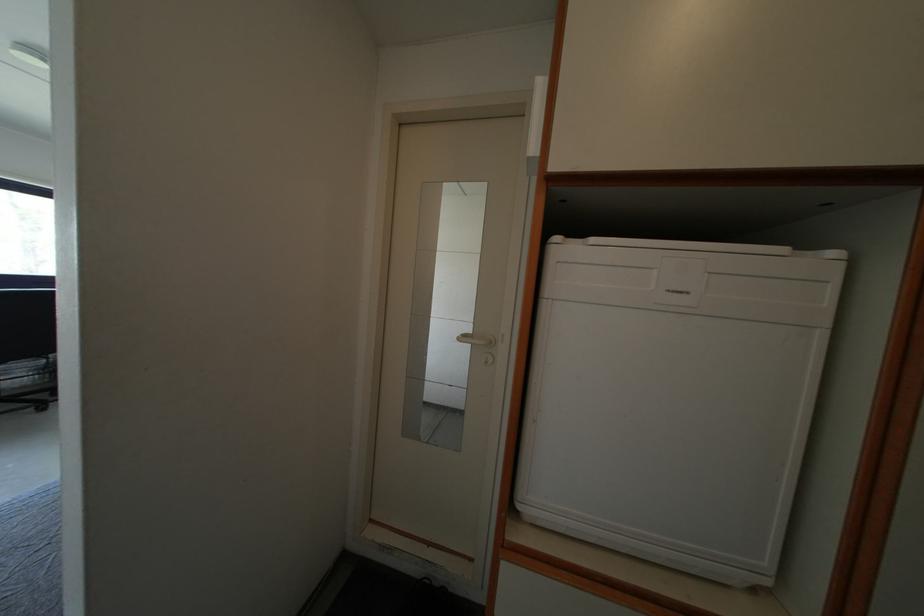
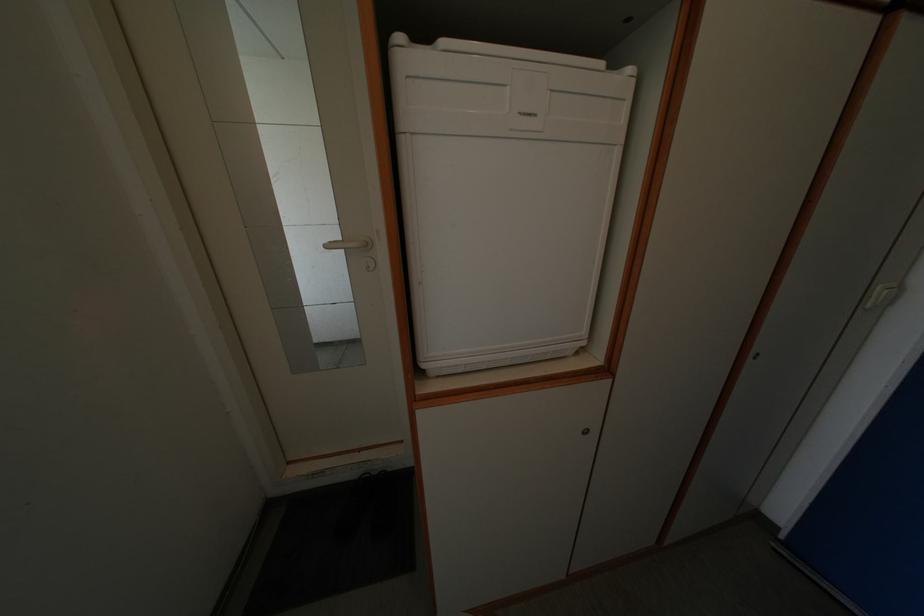
In the second image, find the point that corresponds to pixel 466 339 in the first image.

(332, 246)